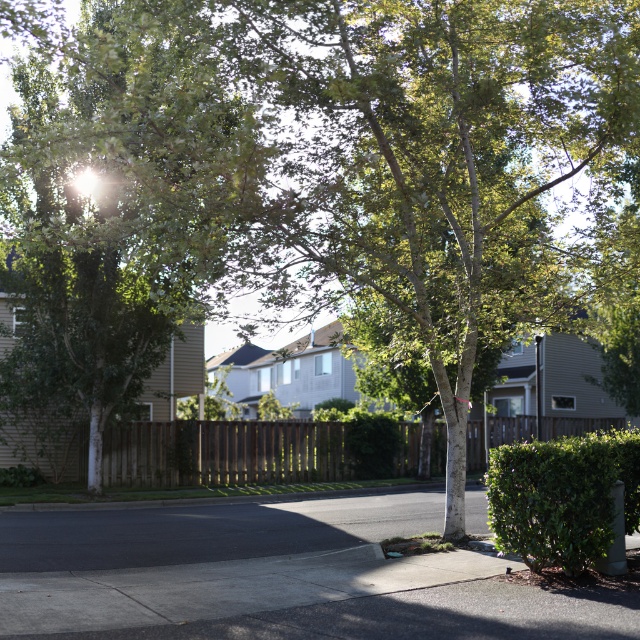
Is point (236, 467) closer to camera compared to point (525, 540)?

No, (236, 467) is further to viewer.

Is point (192, 449) positioned behind point (532, 529)?

That is True.

Is point (516, 426) closer to camera compared to point (596, 515)?

No, (516, 426) is further to viewer.

What are the coordinates of `brown wood fence at center` in the screenshot? It's located at (225, 452).